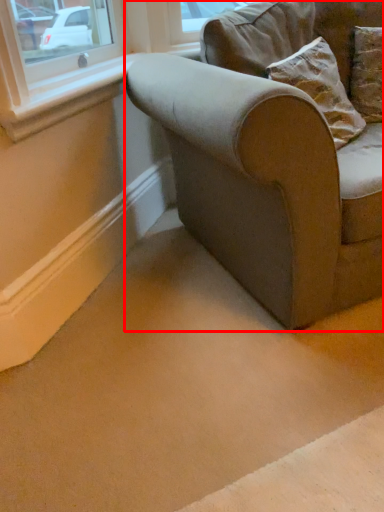
Question: From the image's perspective, what is the correct spatial positioning of studio couch (annotated by the red box) in reference to window sill?

Choices:
 (A) below
 (B) above

Answer: (A)